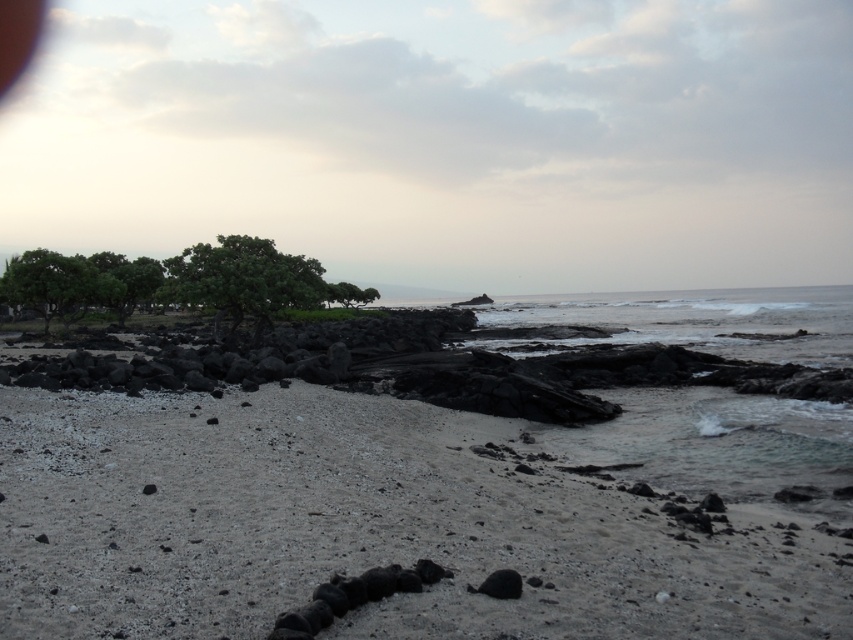
You are standing at the origin point of the image coordinate system. Where is the smooth sand beach at center located in 2D coordinates?

The smooth sand beach at center is located at the 2D coordinates of point (415, 515).

You are standing on the smooth sand beach at center and want to walk to the green leafy tree at upper left. Which direction should you head towards?

You should head towards the upper left direction since the green leafy tree at upper left is further away from you than the smooth sand beach at center.